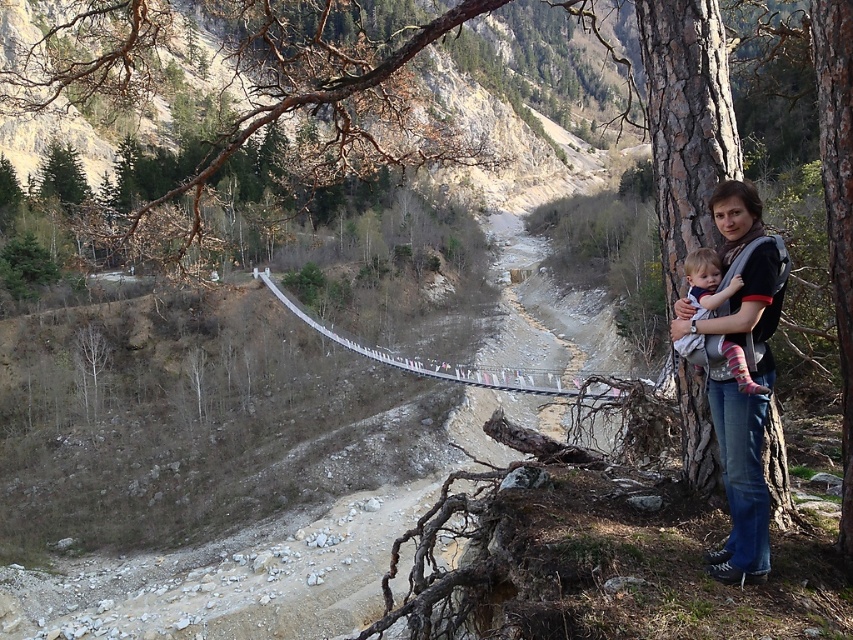
Which is in front, point (428, 371) or point (735, 365)?

Point (735, 365) is more forward.

The width and height of the screenshot is (853, 640). Describe the element at coordinates (440, 362) in the screenshot. I see `white fabric suspension bridge at center` at that location.

Who is more forward, (x=331, y=332) or (x=735, y=368)?

Positioned in front is point (x=735, y=368).

You are a GUI agent. You are given a task and a screenshot of the screen. Output one action in this format:
    pyautogui.click(x=<x>, y=<y>)
    Task: Click on the white fabric suspension bridge at center
    Image resolution: width=853 pixels, height=640 pixels.
    Given the screenshot: What is the action you would take?
    pyautogui.click(x=440, y=362)

What do you see at coordinates (740, 483) in the screenshot?
I see `denim jeans at right` at bounding box center [740, 483].

Does denim jeans at right have a greater width compared to white fabric suspension bridge at center?

Incorrect, denim jeans at right's width does not surpass white fabric suspension bridge at center's.

Who is more forward, (741, 268) or (438, 369)?

Point (741, 268)

The height and width of the screenshot is (640, 853). Find the location of `denim jeans at right`. denim jeans at right is located at coordinates (740, 483).

Looking at this image, between denim jeans at right and soft pink socks at right, which one appears on the right side from the viewer's perspective?

soft pink socks at right is more to the right.

What are the coordinates of `denim jeans at right` in the screenshot? It's located at (740, 483).

The height and width of the screenshot is (640, 853). Find the location of `denim jeans at right`. denim jeans at right is located at coordinates (740, 483).